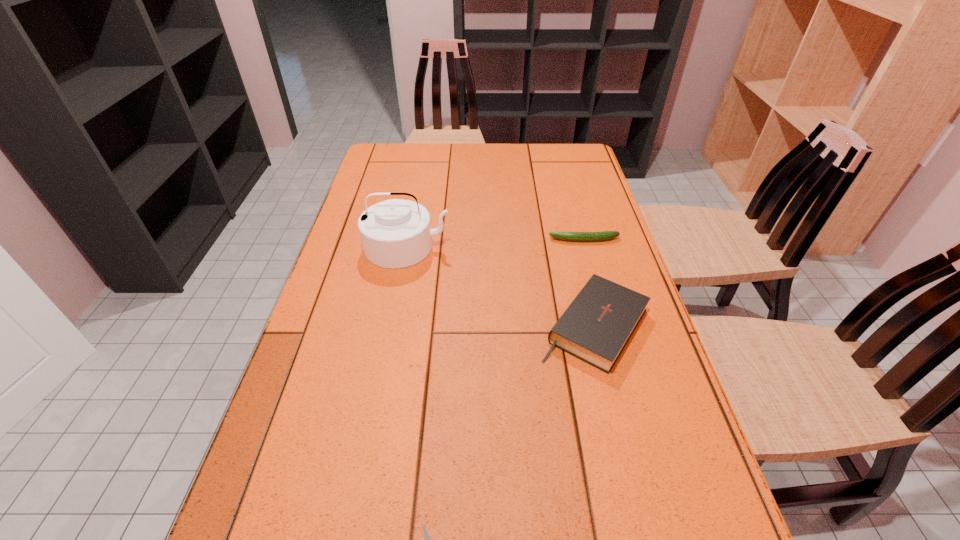
Locate an element on the screen. The height and width of the screenshot is (540, 960). kettle is located at coordinates (395, 233).

Locate an element on the screen. This screenshot has height=540, width=960. the second tallest object is located at coordinates (596, 326).

I want to click on Bible, so click(x=596, y=326).

I want to click on the second shortest object, so click(x=605, y=235).

This screenshot has height=540, width=960. I want to click on free point located on the spout of the tallest object, so click(377, 401).

Locate an element on the screen. The width and height of the screenshot is (960, 540). vacant space located 0.260m on the back of the second nearest object is located at coordinates (569, 226).

Find the location of `blank area located 0.380m on the front-facing side of the zucchini`. blank area located 0.380m on the front-facing side of the zucchini is located at coordinates (419, 240).

Where is `free point located 0.190m on the front-facing side of the zucchini`? The image size is (960, 540). free point located 0.190m on the front-facing side of the zucchini is located at coordinates (484, 240).

Where is `vacant space located on the front-facing side of the zucchini`? The width and height of the screenshot is (960, 540). vacant space located on the front-facing side of the zucchini is located at coordinates (518, 240).

Locate an element on the screen. This screenshot has width=960, height=540. object located at the left edge is located at coordinates (395, 233).